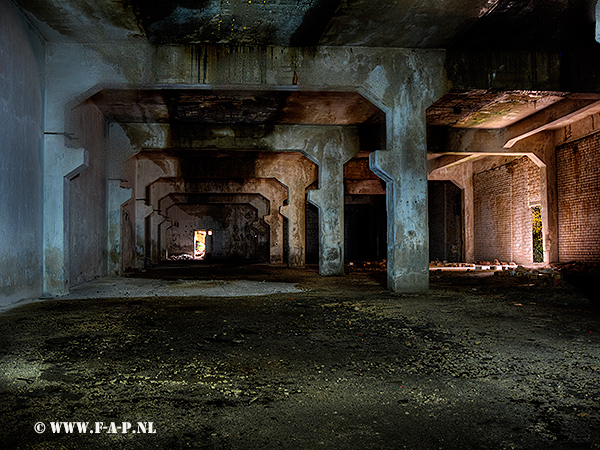
Identify the location of doorway. Image resolution: width=600 pixels, height=450 pixels. (196, 239), (539, 231).